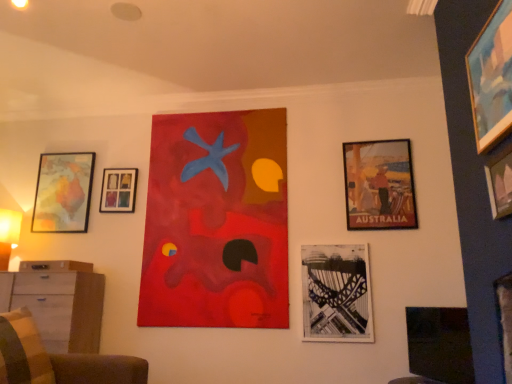
Question: From a real-world perspective, is velvet brown armchair at lower left above or below black paper bridge at lower center, the 5th picture frame from the back?

Choices:
 (A) above
 (B) below

Answer: (B)

Question: Relative to black paper bridge at lower center, the fourth picture frame viewed from the right, is velvet brown armchair at lower left in front or behind?

Choices:
 (A) front
 (B) behind

Answer: (A)

Question: Which object is the farthest from the plaid fabric pillow at lower left?

Choices:
 (A) black paper bridge at lower center, which is counted as the fourth picture frame, starting from the left
 (B) matte black picture frame at lower right, the first picture frame viewed from the right
 (C) wooden dresser at lower left
 (D) matte wooden map at left, which ranks as the seventh picture frame in front-to-back order
 (E) matte paper poster at right, which appears as the third picture frame when viewed from the back

Answer: (E)

Question: Considering the real-world distances, which object is closest to the wooden picture frame at upper right, the seventh picture frame positioned from the back?

Choices:
 (A) matte black picture frame at lower right, the seventh picture frame positioned from the left
 (B) matte brown drawer at left
 (C) velvet brown armchair at lower left
 (D) matte paper poster at right, the 6th picture frame in the left-to-right sequence
 (E) wooden picture frame at upper left, marked as the sixth picture frame in a right-to-left arrangement

Answer: (A)